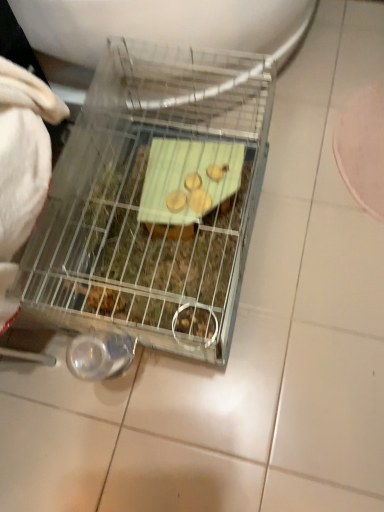
Locate an element on the screen. clear plastic cage at center is located at coordinates [x=154, y=201].

Measure the distance between point (x=218, y=185) and camera.

Point (x=218, y=185) is 98.70 centimeters away from camera.

The height and width of the screenshot is (512, 384). What do you see at coordinates (154, 201) in the screenshot?
I see `clear plastic cage at center` at bounding box center [154, 201].

Find the location of `clear plastic cage at center`. clear plastic cage at center is located at coordinates (154, 201).